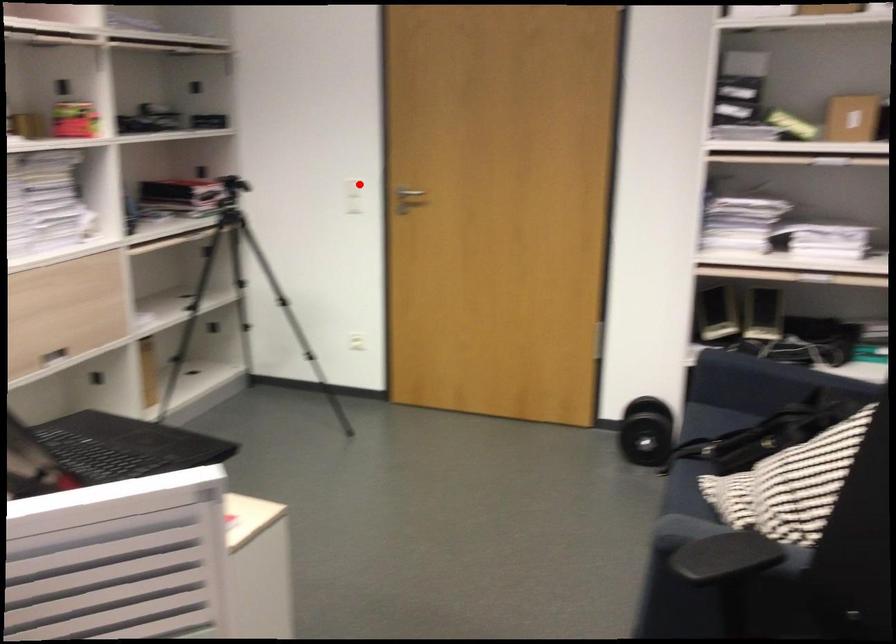
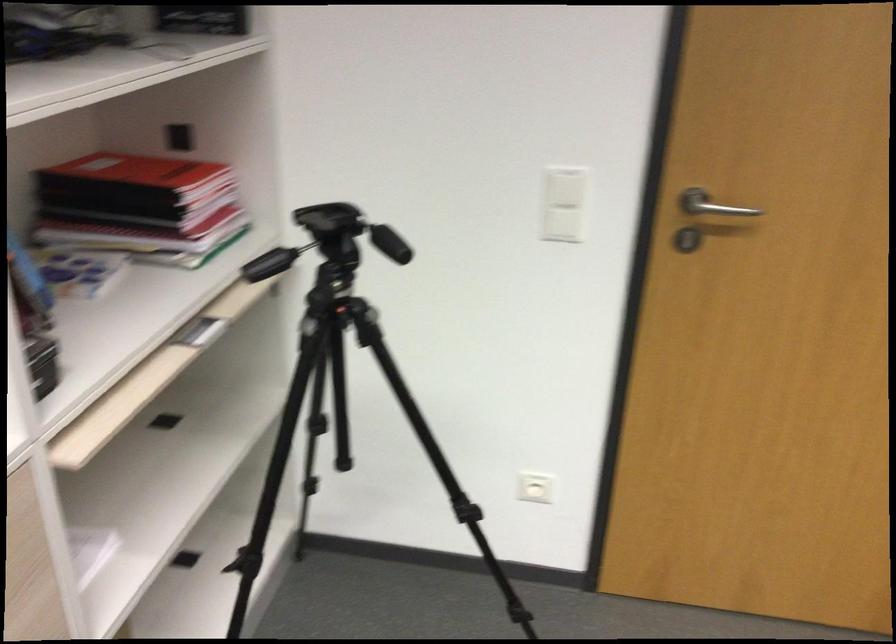
Find the pixel in the second image that matches the highlighted location in the first image.

(565, 187)